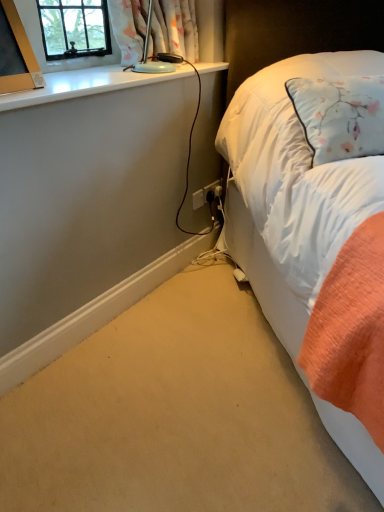
Question: Are matte gold picture frame at upper left and floral fabric curtain at upper left far apart?

Choices:
 (A) yes
 (B) no

Answer: (B)

Question: Does matte gold picture frame at upper left touch floral fabric curtain at upper left?

Choices:
 (A) no
 (B) yes

Answer: (A)

Question: Is matte gold picture frame at upper left smaller than floral fabric curtain at upper left?

Choices:
 (A) no
 (B) yes

Answer: (B)

Question: Is floral fabric curtain at upper left completely or partially inside matte gold picture frame at upper left?

Choices:
 (A) yes
 (B) no

Answer: (B)

Question: Does matte gold picture frame at upper left have a lesser width compared to floral fabric curtain at upper left?

Choices:
 (A) yes
 (B) no

Answer: (A)

Question: In terms of height, does matte gold picture frame at upper left look taller or shorter compared to floral fabric curtain at upper left?

Choices:
 (A) tall
 (B) short

Answer: (A)

Question: From the image's perspective, is matte gold picture frame at upper left positioned above or below floral fabric curtain at upper left?

Choices:
 (A) below
 (B) above

Answer: (A)

Question: Is point click(4, 87) positioned closer to the camera than point click(175, 31)?

Choices:
 (A) farther
 (B) closer

Answer: (B)

Question: Looking at the image, does matte gold picture frame at upper left seem bigger or smaller compared to floral fabric curtain at upper left?

Choices:
 (A) small
 (B) big

Answer: (A)

Question: In terms of height, does white glossy window sill at upper left look taller or shorter compared to white plastic power plugs and sockets at lower center, which appears as the 2th power plugs and sockets when viewed from the right?

Choices:
 (A) short
 (B) tall

Answer: (A)

Question: In terms of size, does white glossy window sill at upper left appear bigger or smaller than white plastic power plugs and sockets at lower center, which appears as the 2th power plugs and sockets when viewed from the right?

Choices:
 (A) small
 (B) big

Answer: (B)

Question: Is point (13, 102) positioned closer to the camera than point (192, 198)?

Choices:
 (A) closer
 (B) farther

Answer: (A)

Question: Looking at their shapes, would you say white glossy window sill at upper left is wider or thinner than white plastic power plugs and sockets at lower center, which appears as the 2th power plugs and sockets when viewed from the right?

Choices:
 (A) wide
 (B) thin

Answer: (A)

Question: Looking at their shapes, would you say floral fabric curtain at upper left is wider or thinner than white plastic power plugs and sockets at lower center, arranged as the first power plugs and sockets when viewed from the left?

Choices:
 (A) thin
 (B) wide

Answer: (B)

Question: Considering the positions of point (124, 25) and point (198, 206), is point (124, 25) closer or farther from the camera than point (198, 206)?

Choices:
 (A) farther
 (B) closer

Answer: (B)